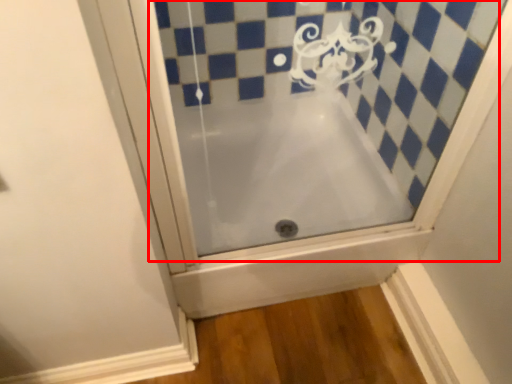
Question: From the image's perspective, what is the correct spatial relationship of bath (annotated by the red box) in relation to bathtub?

Choices:
 (A) above
 (B) below

Answer: (A)